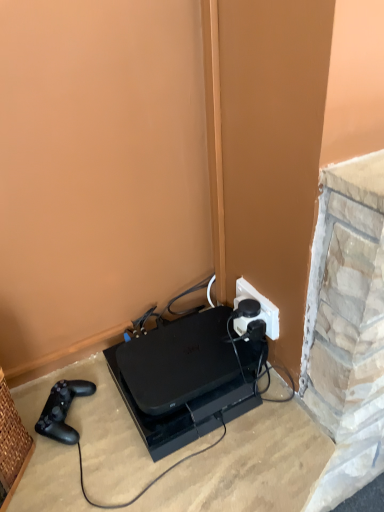
At what (x,y) coordinates should I click in order to perform the action: click on free location to the right of black plastic gaming console at lower center. Please return your answer as a coordinate pair (x, y). This screenshot has height=512, width=384. Looking at the image, I should click on (283, 423).